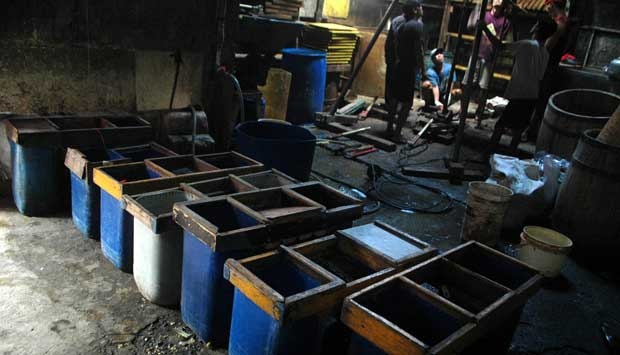
This screenshot has height=355, width=620. Find the location of `wall`. wall is located at coordinates (53, 109).